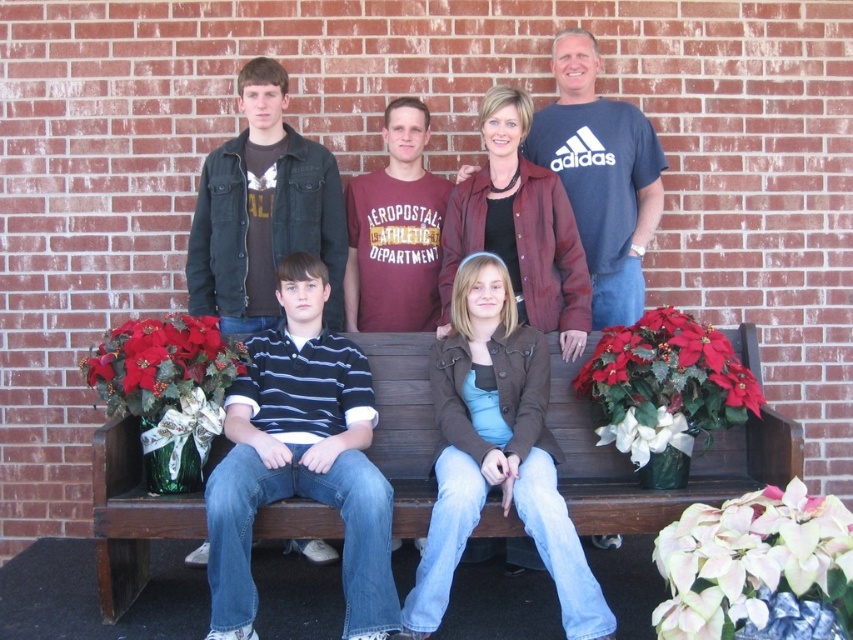
Question: From the image, what is the correct spatial relationship of brown wooden bench at center in relation to silky red poinsettia at left?

Choices:
 (A) below
 (B) above

Answer: (A)

Question: Which point is closer to the camera taking this photo?

Choices:
 (A) (392, 211)
 (B) (637, 333)
 (C) (607, 486)

Answer: (C)

Question: Is pink paper-like petals at lower right positioned at the back of red velvet poinsettia at center?

Choices:
 (A) no
 (B) yes

Answer: (A)

Question: Estimate the real-world distances between objects in this image. Which object is closer to the brown leather jacket at center?

Choices:
 (A) pink paper-like petals at lower right
 (B) red velvet poinsettia at center
 (C) blue striped polo shirt at center

Answer: (B)

Question: Which of these objects is positioned closest to the silky red poinsettia at left?

Choices:
 (A) pink paper-like petals at lower right
 (B) matte black jacket at upper center
 (C) blue striped polo shirt at center

Answer: (C)

Question: Does blue striped polo shirt at center appear under brown leather jacket at center?

Choices:
 (A) no
 (B) yes

Answer: (A)